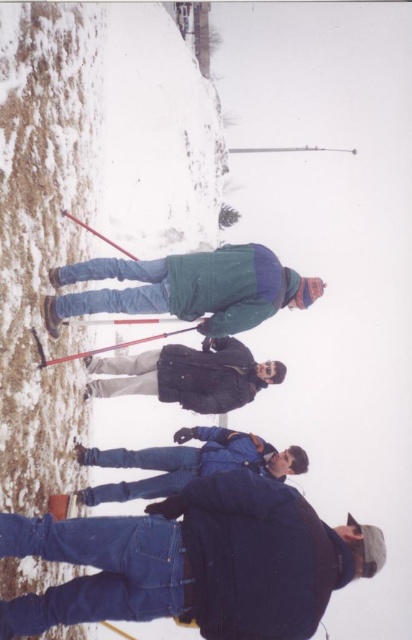
You are observing a snowy scene with two people wearing jackets. You need to determine which jacket is shorter between the denim jacket at lower right and the green matte jacket at center. Based on their positions, can you tell which one is shorter?

The denim jacket at lower right is not as tall as the green matte jacket at center, so the denim jacket at lower right is shorter.

Based on the photo, you are standing in the snowy area and want to take a photo of both the point at coordinates point (x=121, y=385) and point (x=145, y=339). Which point should you focus on first to ensure both are in focus?

You should focus on point (x=121, y=385) first because it is closer to the camera than point (x=145, y=339), ensuring both points are within the depth of field.